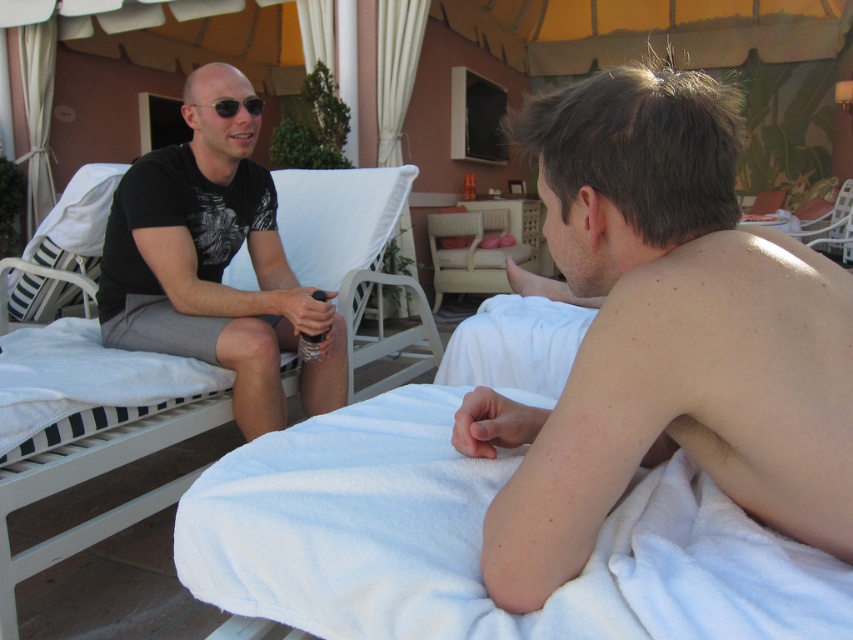
You are planning to pack for a beach trip and have both the white striped fabric beach chair at left and the black matte sunglasses at left. Which item will take up more space in your bag?

The white striped fabric beach chair at left is larger in size compared to the black matte sunglasses at left, so it will take up more space in your bag.

You are a photographer trying to capture both the white fabric beach chair at left and the white striped fabric beach chair at left in a single photo. Which chair should you focus on first to ensure both are in frame?

You should focus on the white fabric beach chair at left first since it is in front of the white striped fabric beach chair at left, allowing both to be captured in the frame.